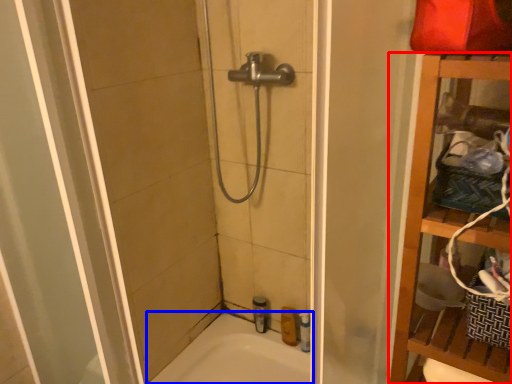
Question: Among these objects, which one is nearest to the camera, furniture (highlighted by a red box) or bathtub (highlighted by a blue box)?

Choices:
 (A) furniture
 (B) bathtub

Answer: (A)